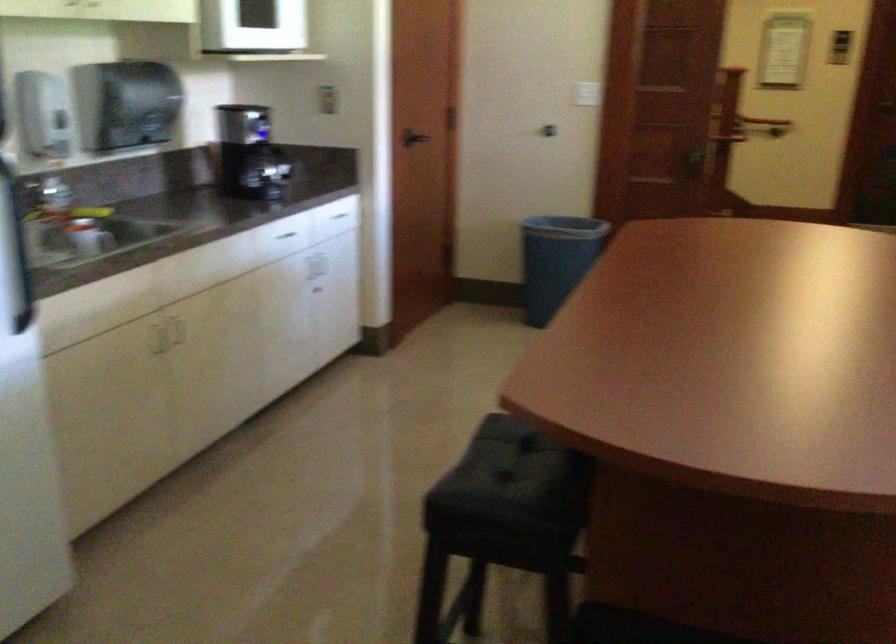
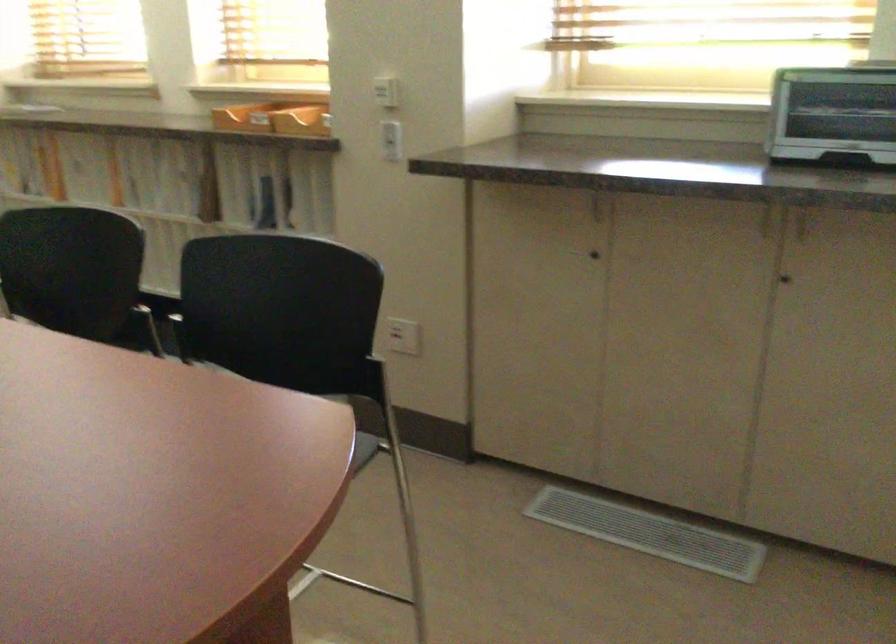
The images are taken continuously from a first-person perspective. In which direction is your viewpoint rotating?

The camera rotated toward right-down.